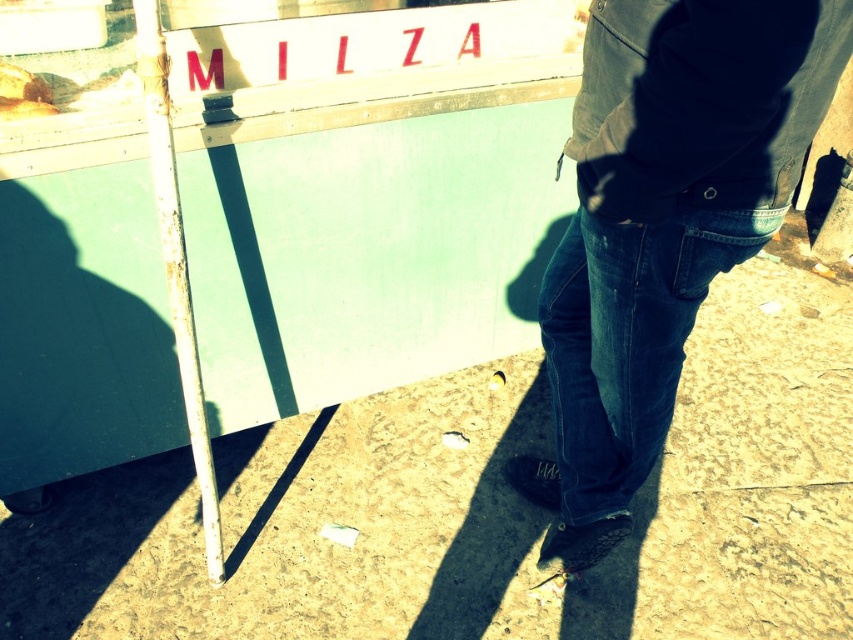
Looking at this image, you are a delivery person standing at point (759, 164) and need to deliver a package to point (492, 472). Given the scene, is the destination point behind you or in front of you?

The destination point (492, 472) is behind you because according to the objects description, point (492, 472) is behind point (759, 164).

You are a delivery robot that needs to place a package on the ground near the food truck. The package must be placed on the brown textured pavement at lower center. However, there is an obstacle at the dark blue jeans at lower right. Can you safely place the package on the pavement without the obstacle blocking the way?

The brown textured pavement at lower center is shorter than dark blue jeans at lower right, meaning the jeans are taller and might block access to the pavement. Therefore, the delivery robot should check if there is enough space around the dark blue jeans at lower right to reach the pavement safely before placing the package.